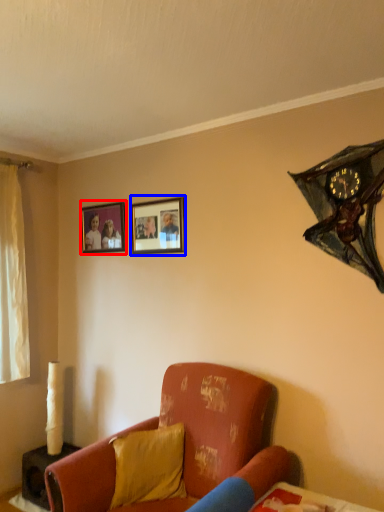
Question: Which object appears farthest to the camera in this image, picture frame (highlighted by a red box) or picture frame (highlighted by a blue box)?

Choices:
 (A) picture frame
 (B) picture frame

Answer: (A)